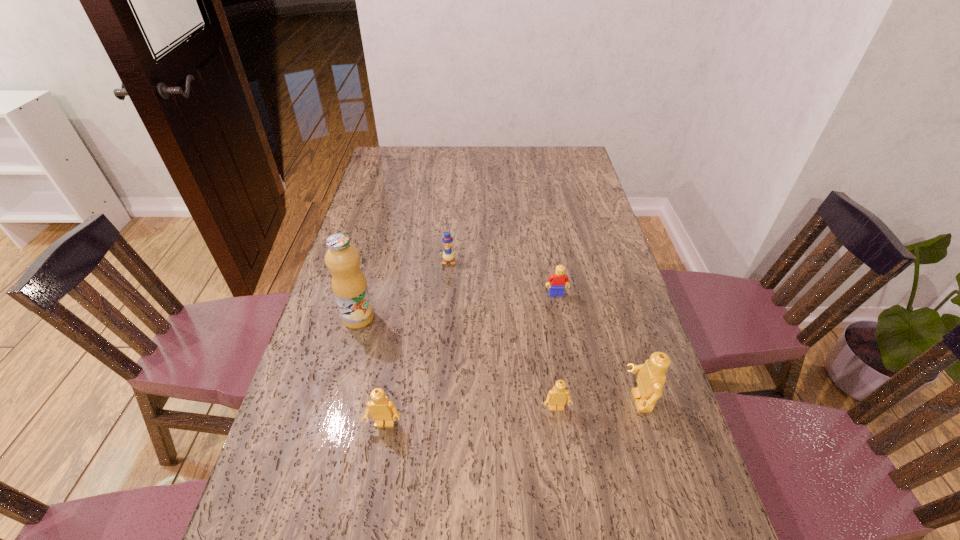
This screenshot has width=960, height=540. Find the location of `vacant space situated on the face of the rightmost Lego`. vacant space situated on the face of the rightmost Lego is located at coordinates (479, 401).

At what (x,y) coordinates should I click in order to perform the action: click on free location located on the face of the rightmost Lego. Please return your answer as a coordinate pair (x, y). Looking at the image, I should click on (592, 401).

Find the location of a particular element. This screenshot has height=540, width=960. vacant space located on the face of the third object from left to right, where the monocle is placed is located at coordinates (442, 340).

Find the location of a particular element. This screenshot has width=960, height=540. free space located on the face of the farthest Lego is located at coordinates (572, 384).

Image resolution: width=960 pixels, height=540 pixels. Find the location of `vacant region located 0.290m on the front label of the leftmost object`. vacant region located 0.290m on the front label of the leftmost object is located at coordinates (477, 318).

The width and height of the screenshot is (960, 540). I want to click on object present at the left edge, so click(349, 284).

Find the location of a particular element. The height and width of the screenshot is (540, 960). object that is at the right edge is located at coordinates (651, 378).

Find the location of a particular element. The image size is (960, 540). free space at the far edge of the desktop is located at coordinates (453, 154).

In the image, there is a desktop. Where is `free space at the near edge`? The height and width of the screenshot is (540, 960). free space at the near edge is located at coordinates (449, 507).

Where is `vacant space at the left edge of the desktop`? This screenshot has width=960, height=540. vacant space at the left edge of the desktop is located at coordinates (346, 349).